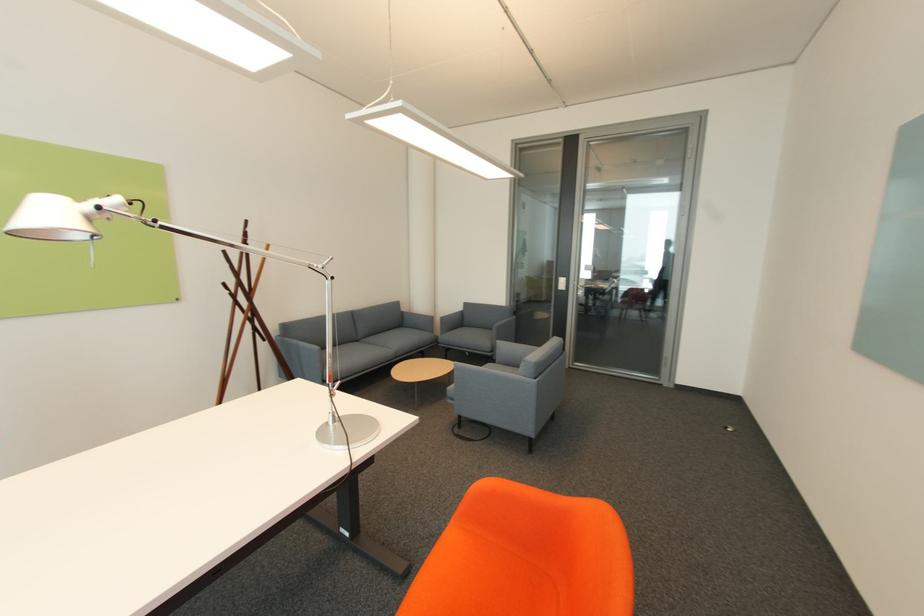
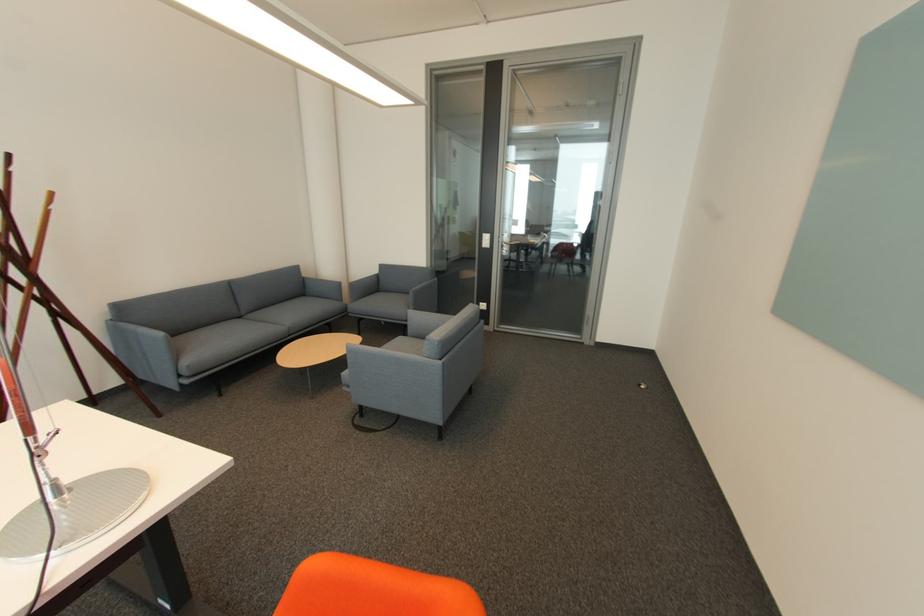
Find the pixel in the second image that matches pixel 301 342 in the first image.

(139, 328)